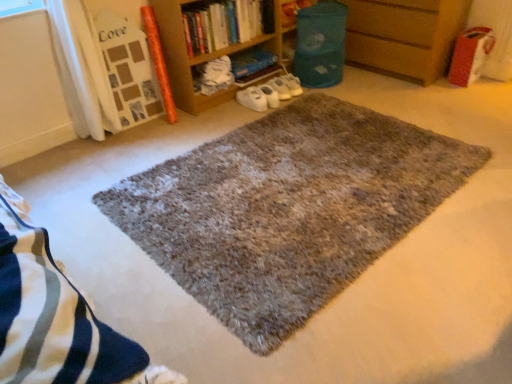
Question: Is hardcover book at center, marked as the second book in a front-to-back arrangement, oriented away from shaggy gray rug at center?

Choices:
 (A) yes
 (B) no

Answer: (B)

Question: Is hardcover book at center, the 1th book in the back-to-front sequence, oriented towards shaggy gray rug at center?

Choices:
 (A) no
 (B) yes

Answer: (B)

Question: Is hardcover book at center, marked as the second book in a front-to-back arrangement, outside of shaggy gray rug at center?

Choices:
 (A) no
 (B) yes

Answer: (B)

Question: Is hardcover book at center, the 1th book in the back-to-front sequence, wider than shaggy gray rug at center?

Choices:
 (A) yes
 (B) no

Answer: (B)

Question: Is hardcover book at center, marked as the second book in a front-to-back arrangement, with shaggy gray rug at center?

Choices:
 (A) yes
 (B) no

Answer: (B)

Question: Is hardcover book at center, marked as the second book in a front-to-back arrangement, at the right side of shaggy gray rug at center?

Choices:
 (A) no
 (B) yes

Answer: (A)

Question: Is wooden at right to the left of brown wooden bookcase at upper center from the viewer's perspective?

Choices:
 (A) yes
 (B) no

Answer: (B)

Question: From the image's perspective, would you say wooden at right is shown under brown wooden bookcase at upper center?

Choices:
 (A) yes
 (B) no

Answer: (B)

Question: Does wooden at right have a smaller size compared to brown wooden bookcase at upper center?

Choices:
 (A) yes
 (B) no

Answer: (B)

Question: From a real-world perspective, is wooden at right beneath brown wooden bookcase at upper center?

Choices:
 (A) yes
 (B) no

Answer: (A)

Question: Is wooden at right facing away from brown wooden bookcase at upper center?

Choices:
 (A) yes
 (B) no

Answer: (B)

Question: From the image's perspective, would you say wooden at right is positioned over brown wooden bookcase at upper center?

Choices:
 (A) yes
 (B) no

Answer: (A)

Question: From a real-world perspective, is shaggy gray rug at center physically below hardcover book at center, marked as the second book in a front-to-back arrangement?

Choices:
 (A) no
 (B) yes

Answer: (B)